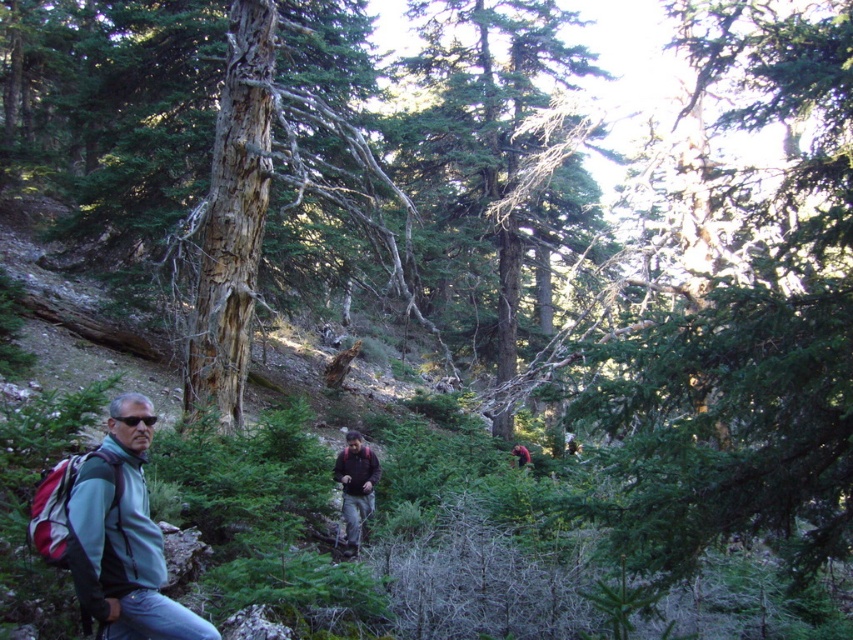
Question: Which object is the closest to the dark brown fabric at center?

Choices:
 (A) dark brown leather jacket at center
 (B) green needle-like tree at upper center
 (C) green textured tree at center

Answer: (B)

Question: Estimate the real-world distances between objects in this image. Which object is farther from the green needle-like tree at upper center?

Choices:
 (A) dark brown fabric at center
 (B) dark brown leather jacket at center
 (C) green textured tree at center

Answer: (C)

Question: Does dark brown fabric at center come behind dark brown leather jacket at center?

Choices:
 (A) yes
 (B) no

Answer: (B)

Question: Considering the real-world distances, which object is farthest from the green textured tree at center?

Choices:
 (A) brushed metal jacket at lower left
 (B) dark brown fabric at center
 (C) green needle-like tree at upper center
 (D) dark brown leather jacket at center

Answer: (A)

Question: Observing the image, what is the correct spatial positioning of brushed metal jacket at lower left in reference to dark brown fabric at center?

Choices:
 (A) below
 (B) above

Answer: (B)

Question: Is green needle-like tree at upper center to the right of green textured tree at center from the viewer's perspective?

Choices:
 (A) no
 (B) yes

Answer: (B)